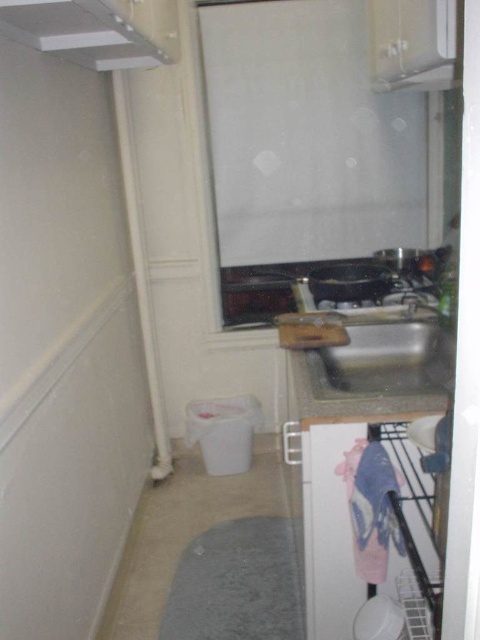
You are a chef preparing to cook a meal in this kitchen. You need to place a pot on the stovetop. Is the white matte exhaust hood at upper left located above the metallic sink at center where the stovetop is?

The white matte exhaust hood at upper left is positioned over the metallic sink at center, so yes, the exhaust hood is above the sink where the stovetop is located, meaning the pot can be placed on the stovetop under the exhaust hood.

You are a chef trying to hang a new exhaust filter. You need to know the distance between the white matte exhaust hood at upper left and the black pan on the stovetop. Can you confirm if it is more than 1 meter?

The distance between the white matte exhaust hood at upper left and the black pan on the stovetop is 1.12 meters, so yes, it is more than 1 meter.

You are standing in the kitchen and want to locate the white matte exhaust hood at upper left. According to the coordinates provided, where exactly is it positioned?

The white matte exhaust hood at upper left is located at point coordinates of (x=96, y=29).